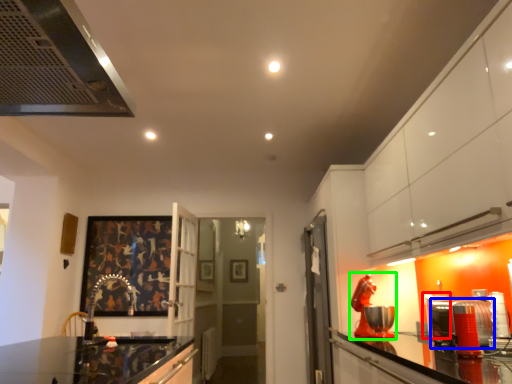
Question: Which object is the farthest from appliance (highlighted by a red box)? Choose among these: appliance (highlighted by a blue box) or appliance (highlighted by a green box).

Choices:
 (A) appliance
 (B) appliance

Answer: (A)